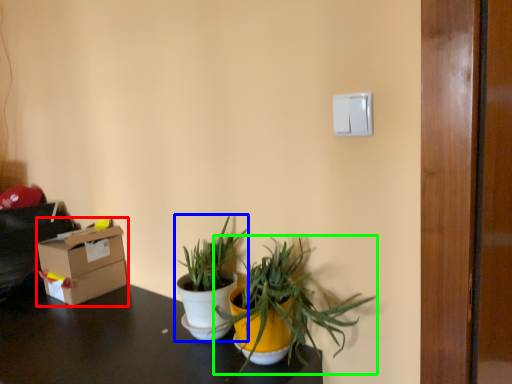
Question: Estimate the real-world distances between objects in this image. Which object is farther from box (highlighted by a red box), houseplant (highlighted by a blue box) or houseplant (highlighted by a green box)?

Choices:
 (A) houseplant
 (B) houseplant

Answer: (B)